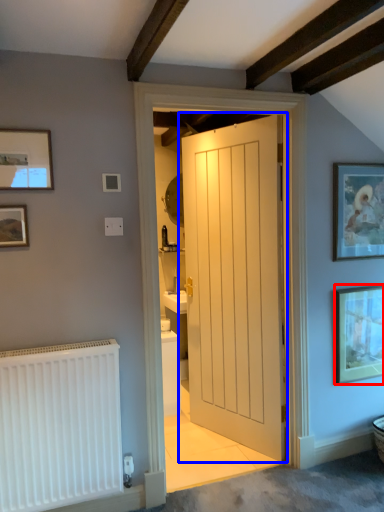
Question: Which object is closer to the camera taking this photo, picture frame (highlighted by a red box) or door (highlighted by a blue box)?

Choices:
 (A) picture frame
 (B) door

Answer: (B)